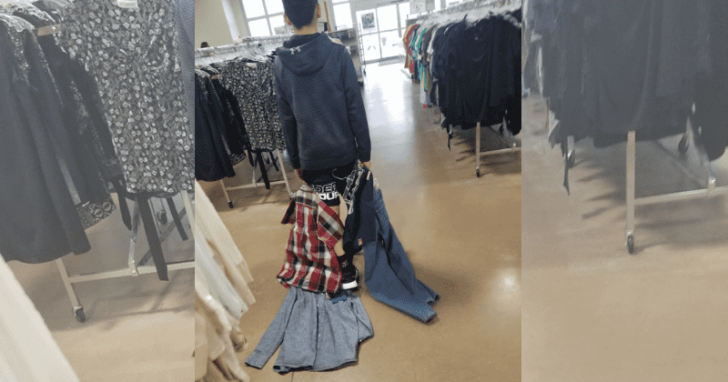
This screenshot has height=382, width=728. Identify the location of tan concrete floor. (478, 261).